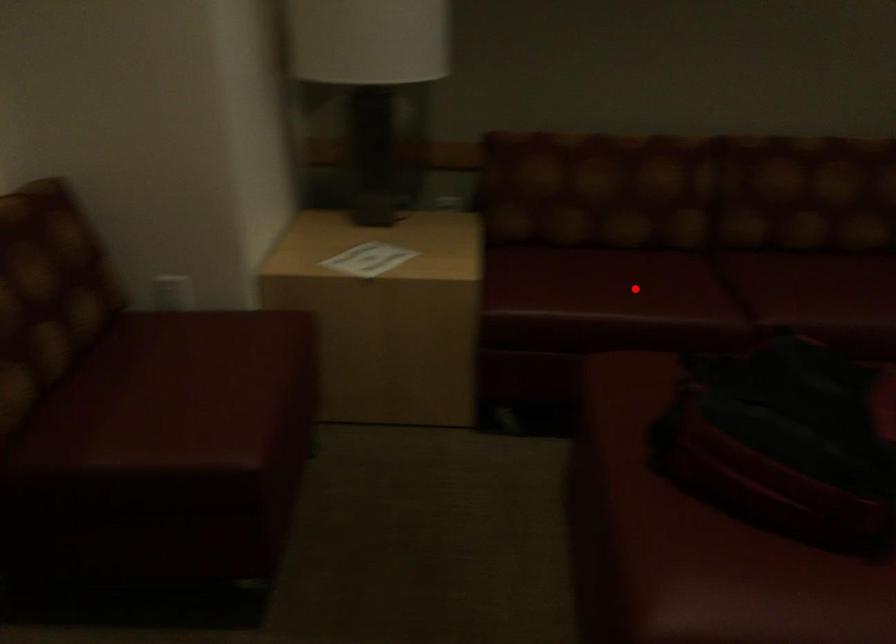
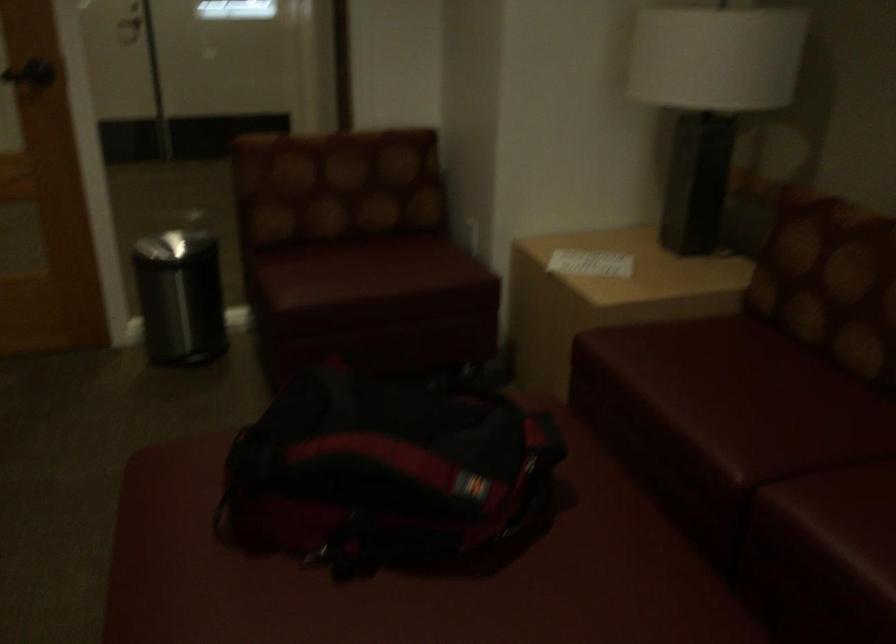
In the second image, find the point that corresponds to the highlighted location in the first image.

(731, 397)